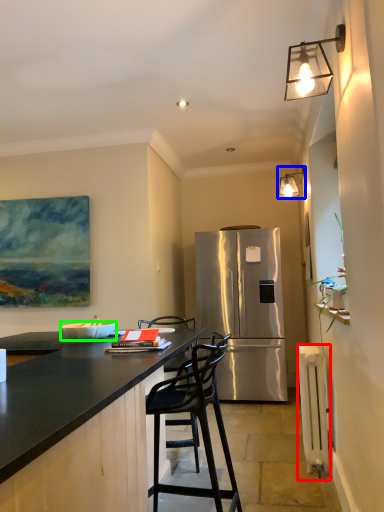
Question: Which object is the closest to the radiator (highlighted by a red box)? Choose among these: lamp (highlighted by a blue box) or bowl (highlighted by a green box).

Choices:
 (A) lamp
 (B) bowl

Answer: (B)